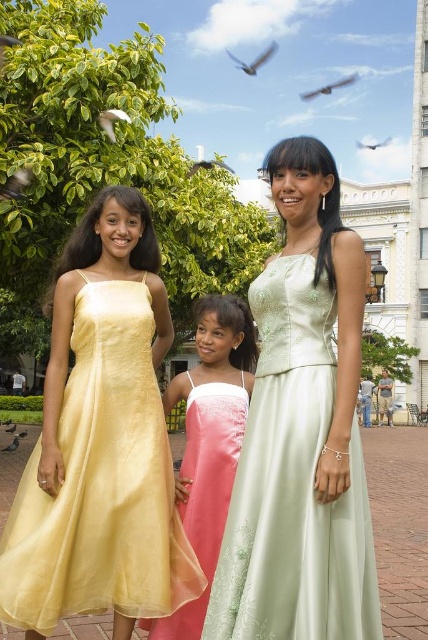
Question: Which object appears closest to the camera in this image?

Choices:
 (A) satin pale green dress at center
 (B) smooth feathered bird at upper center
 (C) brown feathered bird at center
 (D) gray feathered bird at upper center

Answer: (A)

Question: In this image, where is satin pale green dress at center located relative to gray feathered pigeon at center?

Choices:
 (A) right
 (B) left

Answer: (A)

Question: Estimate the real-world distances between objects in this image. Which object is closer to the satin pale green dress at center?

Choices:
 (A) smooth feathered bird at upper center
 (B) matte yellow dress at center

Answer: (B)

Question: Can you confirm if satin pale green dress at center is bigger than pink satin dress at center?

Choices:
 (A) no
 (B) yes

Answer: (B)

Question: Which of the following is the farthest from the observer?

Choices:
 (A) (267, 45)
 (B) (8, 428)
 (C) (371, 147)
 (D) (106, 115)

Answer: (A)

Question: Is matte yellow dress at center positioned at the back of pink satin dress at center?

Choices:
 (A) no
 (B) yes

Answer: (A)